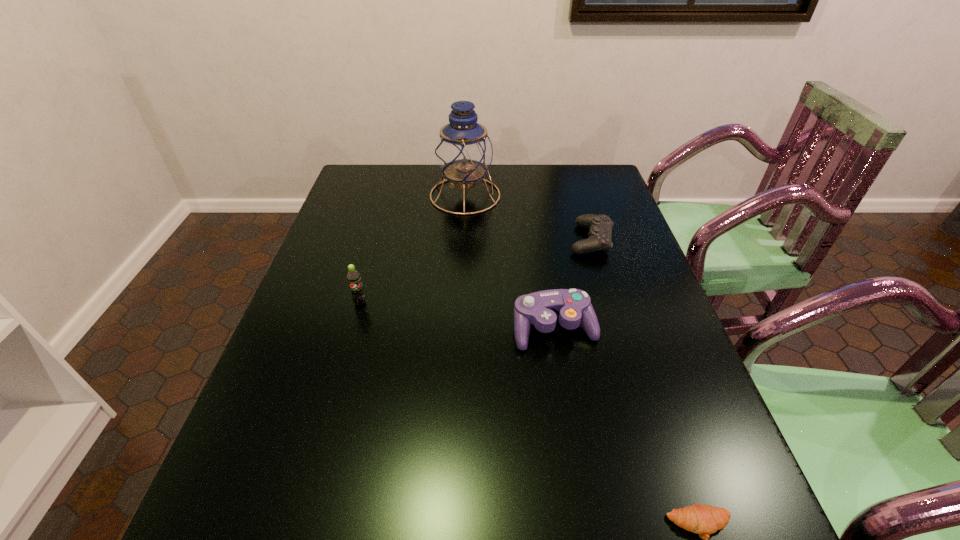
Where is `vacant region that satisfies the following two spatial constraints: 1. on the front-facing side of the lantern; 2. on the front label of the fourth shortest object`? This screenshot has width=960, height=540. vacant region that satisfies the following two spatial constraints: 1. on the front-facing side of the lantern; 2. on the front label of the fourth shortest object is located at coordinates (460, 302).